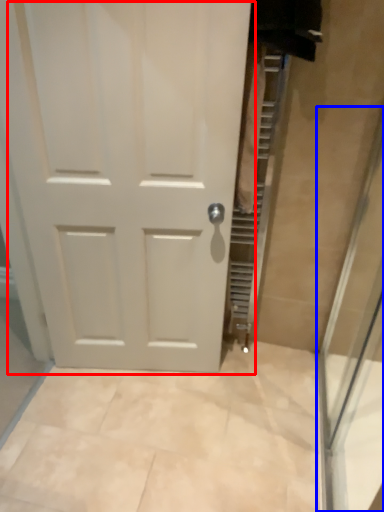
Question: Which of the following is the closest to the observer, door (highlighted by a red box) or shower door (highlighted by a blue box)?

Choices:
 (A) door
 (B) shower door

Answer: (B)